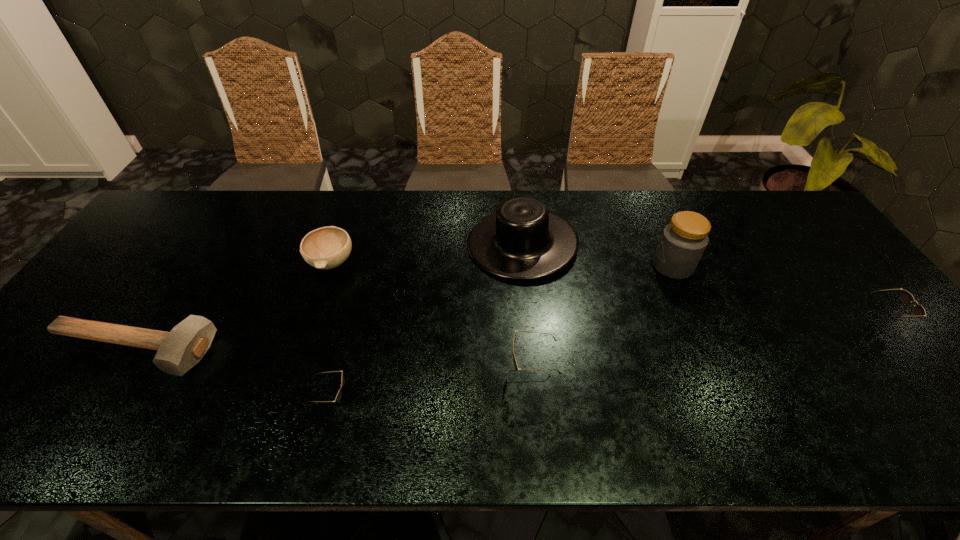
Find the location of a particular element. The height and width of the screenshot is (540, 960). blank area located 0.220m in front of the lenses of the leftmost sunglasses is located at coordinates (x=448, y=402).

Where is `vacant space situated in front of the lenses of the second sunglasses from right to left`? vacant space situated in front of the lenses of the second sunglasses from right to left is located at coordinates (488, 373).

At what (x,y) coordinates should I click in order to perform the action: click on free space located 0.310m in front of the lenses of the second sunglasses from right to left. Please return your answer as a coordinate pair (x, y). The height and width of the screenshot is (540, 960). Looking at the image, I should click on (376, 373).

Identify the location of vacant space located 0.400m in front of the lenses of the second sunglasses from right to left. The image size is (960, 540). (338, 373).

Find the location of a particular element. The image size is (960, 540). free spot located 0.230m on the left of the second tallest object is located at coordinates (392, 244).

Where is `vacant space located 0.340m on the front of the bowl`? vacant space located 0.340m on the front of the bowl is located at coordinates (288, 394).

What are the coordinates of `vacant region located on the surface of the tallest object near the warning symbol` in the screenshot? It's located at (584, 266).

Locate an element on the screen. This screenshot has height=540, width=960. free space located 0.390m on the surface of the tallest object near the warning symbol is located at coordinates (518, 266).

You are a GUI agent. You are given a task and a screenshot of the screen. Output one action in this format:
    pyautogui.click(x=<x>, y=<y>)
    Task: Click on the free space located 0.110m on the surface of the tallest object near the warning symbol
    
    Given the screenshot: What is the action you would take?
    pyautogui.click(x=614, y=266)

Find the location of `free spot located 0.220m on the right of the leftmost object`. free spot located 0.220m on the right of the leftmost object is located at coordinates (301, 350).